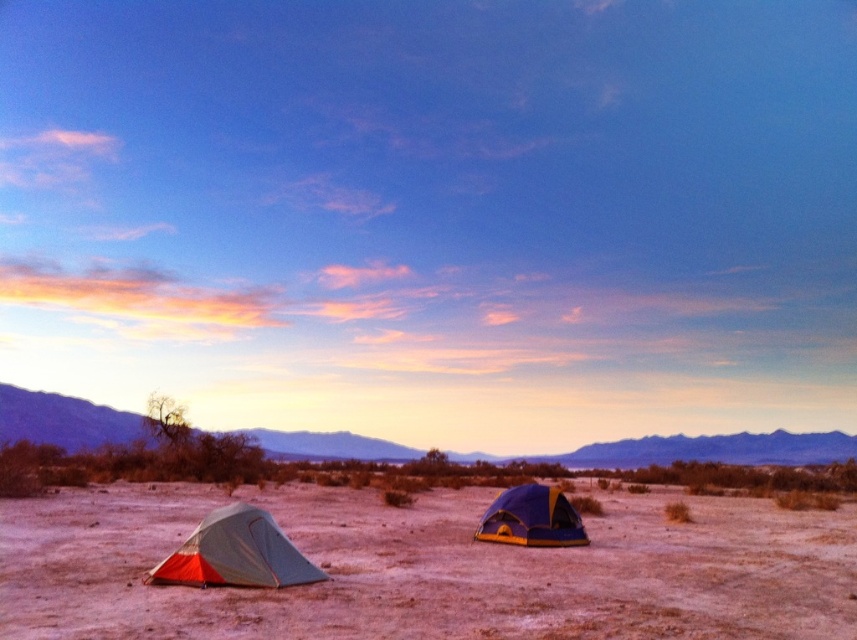
You are a hiker who wants to set up a campsite. You see the gray sand at center and the orange fabric tent at lower left. Which location would you choose to place your tent to avoid being buried by the sand?

The orange fabric tent at lower left should be placed at the lower left location because the gray sand at center is much taller, meaning the sand there is higher and could bury the tent if placed there.